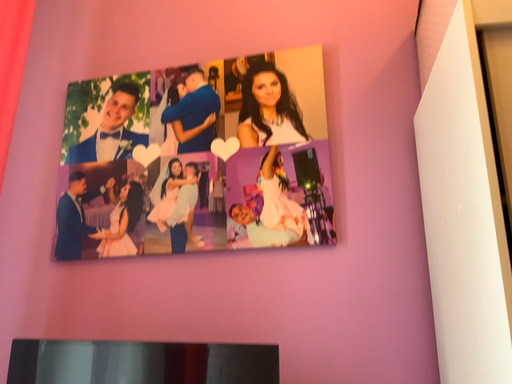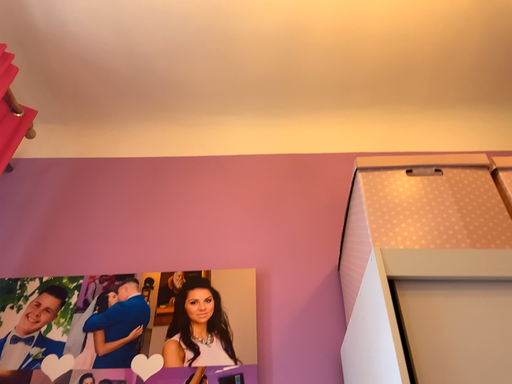
Question: Which way did the camera rotate in the video?

Choices:
 (A) rotated downward
 (B) rotated upward

Answer: (B)